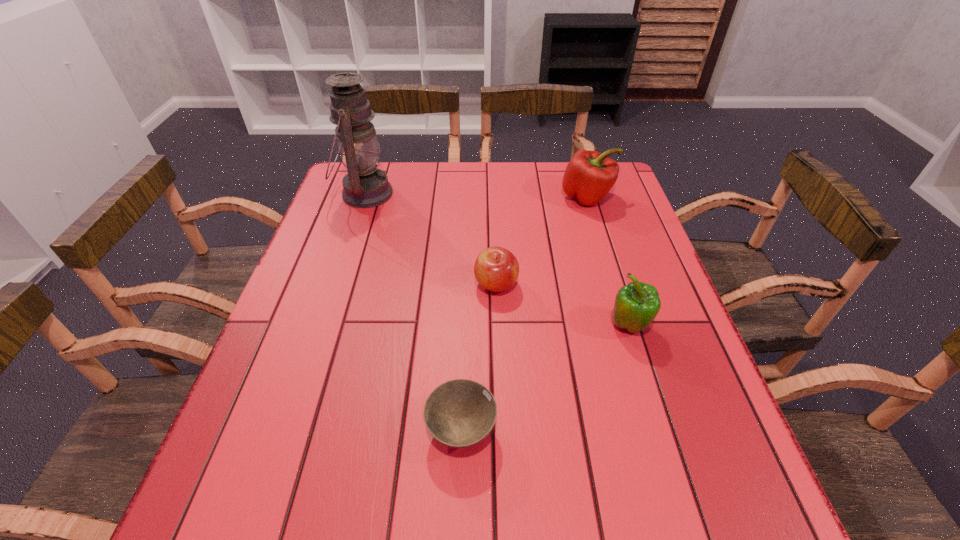
Locate an element on the screen. blank region between the bowl and the second shortest object is located at coordinates (479, 357).

Locate an element on the screen. The width and height of the screenshot is (960, 540). object that is the second closest to the fourth tallest object is located at coordinates (460, 413).

Identify which object is located as the second nearest to the nearest object. Please provide its 2D coordinates. Your answer should be formatted as a tuple, i.e. [(x, y)], where the tuple contains the x and y coordinates of a point satisfying the conditions above.

[(636, 305)]

Locate an element on the screen. vacant area that satisfies the following two spatial constraints: 1. on the back side of the farther bell pepper; 2. on the right side of the nearest object is located at coordinates click(x=468, y=197).

Identify the location of blank space that satisfies the following two spatial constraints: 1. on the front side of the tallest object; 2. on the right side of the nearer bell pepper. This screenshot has height=540, width=960. (321, 327).

Identify the location of free location that satisfies the following two spatial constraints: 1. on the front side of the apple; 2. on the left side of the leftmost object. (334, 285).